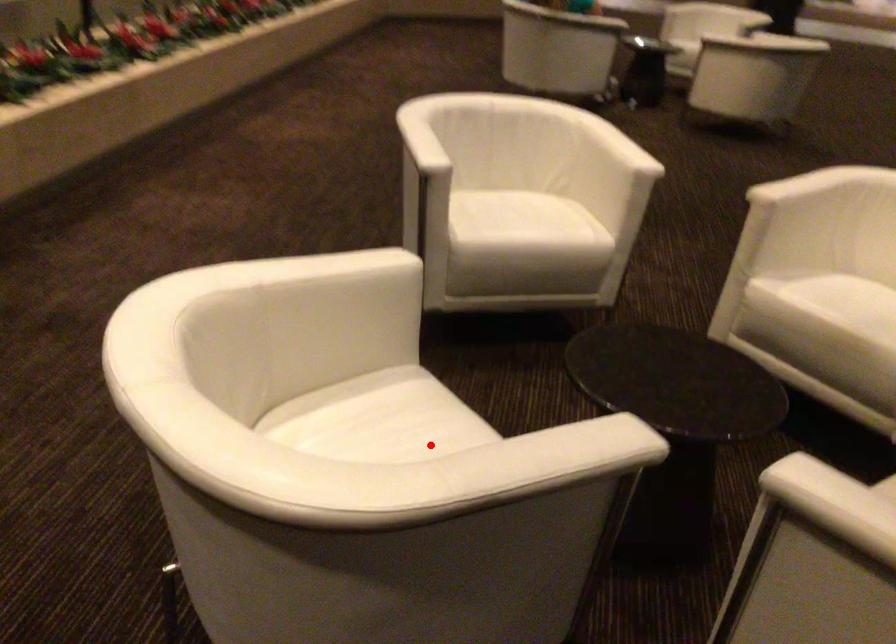
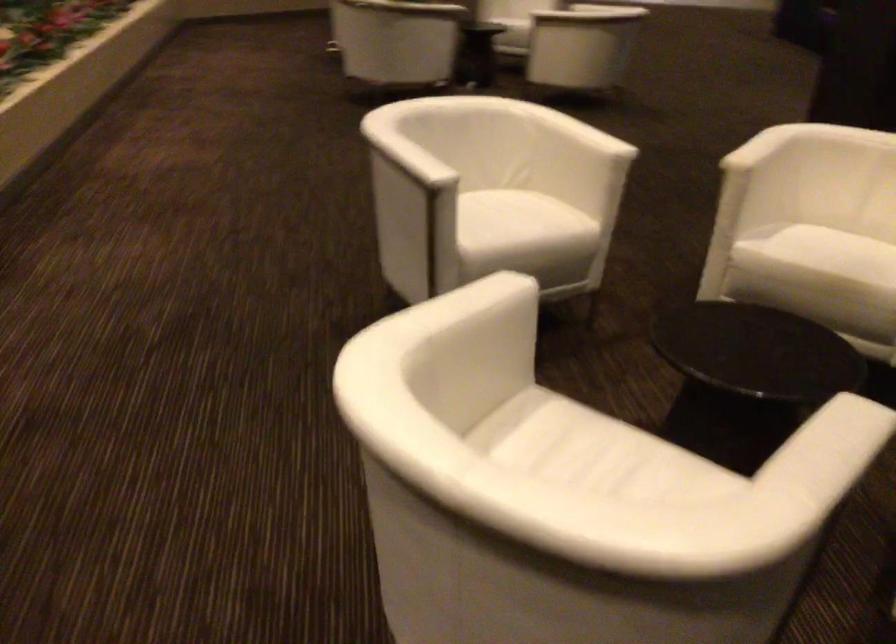
The point at the highlighted location is marked in the first image. Where is the corresponding point in the second image?

(616, 462)